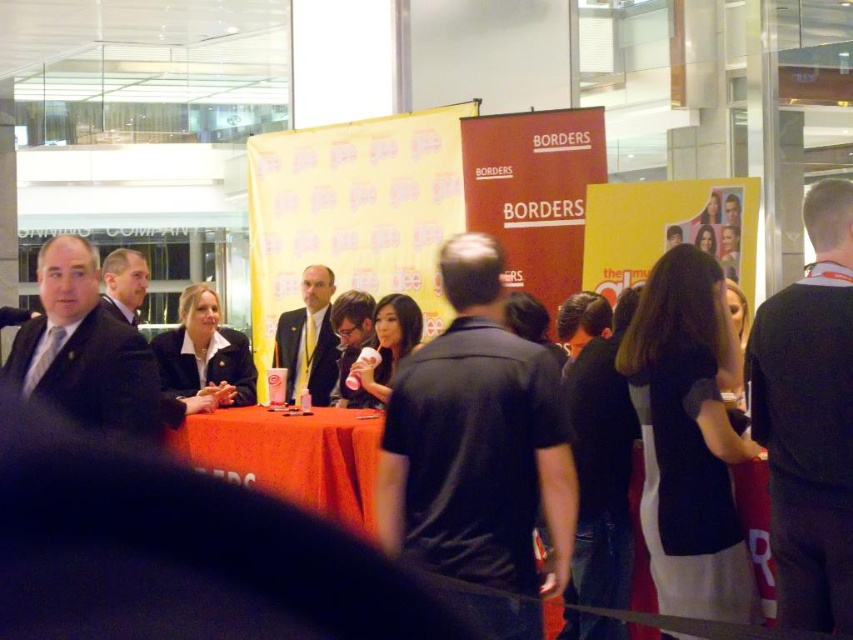
Between point (621, 429) and point (134, 296), which one is positioned behind?

The point (134, 296) is more distant.

Does black fabric business suit at center have a lesser width compared to matte black suit at center?

In fact, black fabric business suit at center might be wider than matte black suit at center.

Which is behind, point (596, 630) or point (114, 308)?

Positioned behind is point (114, 308).

This screenshot has height=640, width=853. What are the coordinates of `black fabric business suit at center` in the screenshot? It's located at (601, 476).

Is black matte shirt at center in front of dark gray suit at left?

Yes.

Between point (498, 289) and point (120, 305), which one is positioned behind?

The point (120, 305) is more distant.

The width and height of the screenshot is (853, 640). I want to click on black matte shirt at center, so click(x=477, y=442).

Based on the photo, can you confirm if black matte shirt at center is positioned to the left of matte black suit at center?

In fact, black matte shirt at center is to the right of matte black suit at center.

Does black matte shirt at center have a greater width compared to matte black suit at center?

Correct, the width of black matte shirt at center exceeds that of matte black suit at center.

What do you see at coordinates (477, 442) in the screenshot? I see `black matte shirt at center` at bounding box center [477, 442].

Find the location of `black matte shirt at center`. black matte shirt at center is located at coordinates (477, 442).